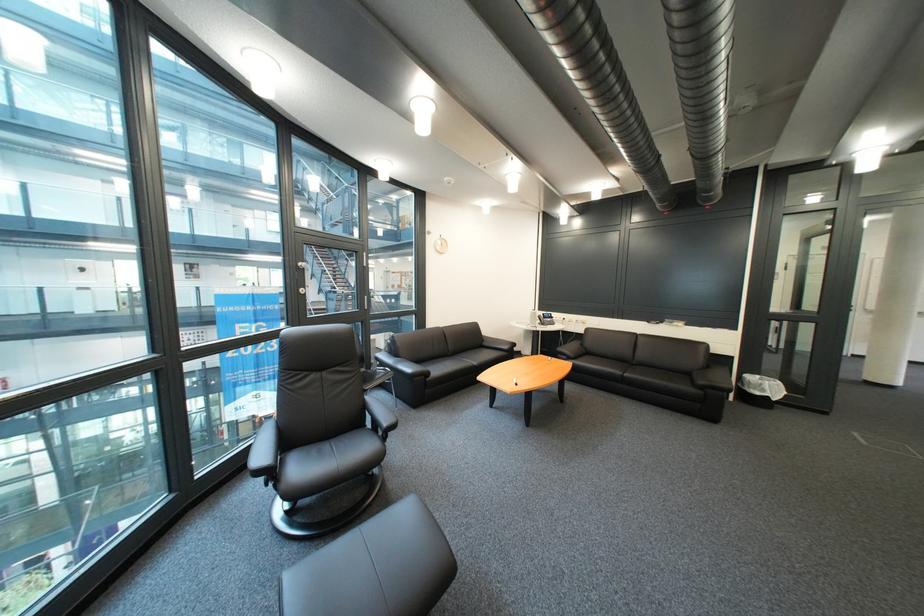
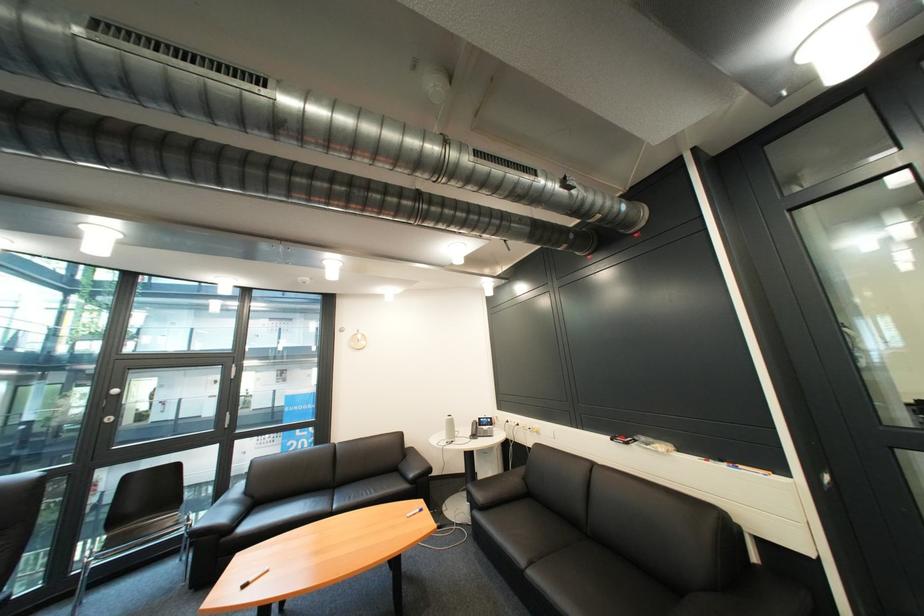
The point at (497, 346) is marked in the first image. Where is the corresponding point in the second image?

(414, 468)